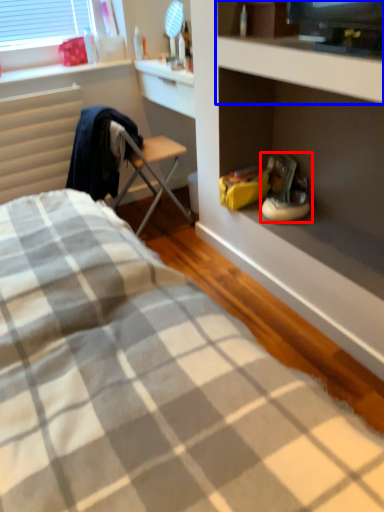
Question: Which point is closer to the camera, footwear (highlighted by a red box) or cabinet (highlighted by a blue box)?

Choices:
 (A) footwear
 (B) cabinet

Answer: (B)